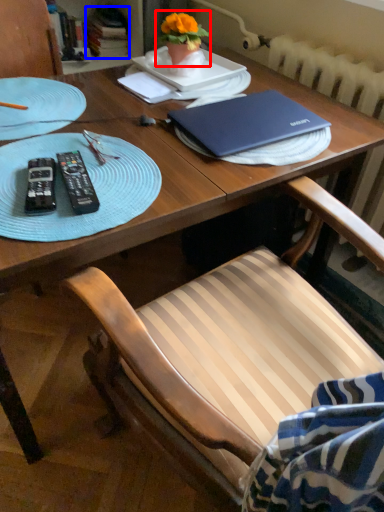
Question: Which point is further to the camera, houseplant (highlighted by a red box) or book (highlighted by a blue box)?

Choices:
 (A) houseplant
 (B) book

Answer: (B)